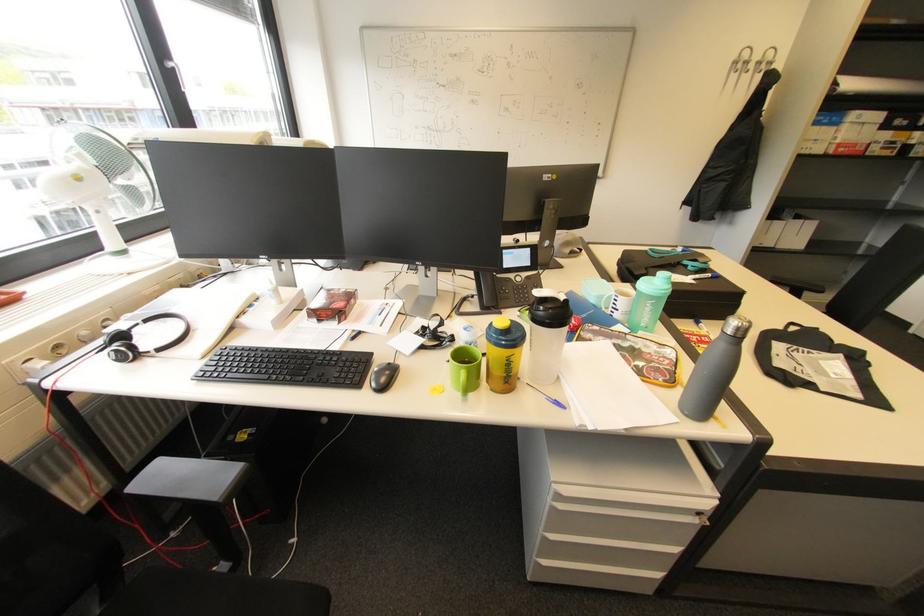
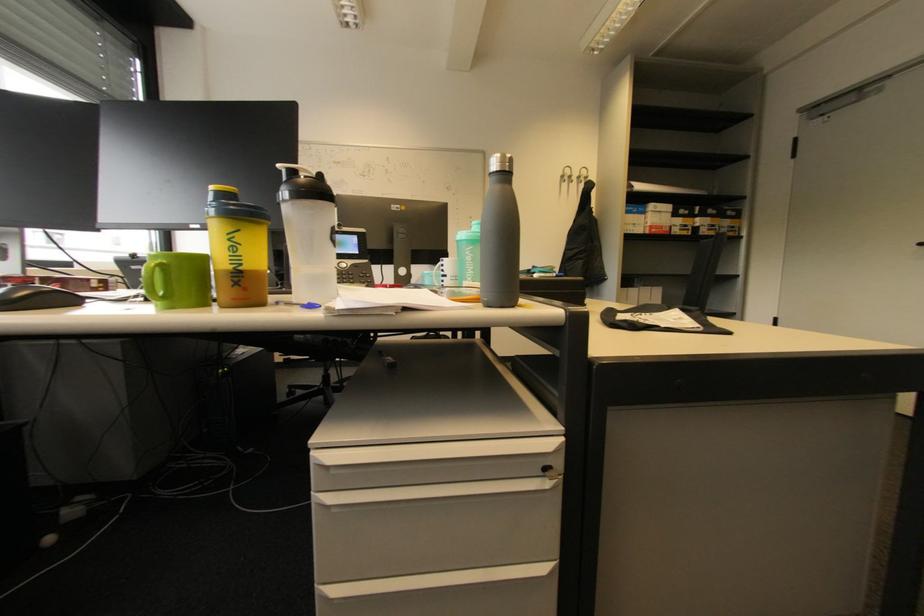
In the second image, find the point that corresponds to point 764,63 in the first image.

(584, 177)